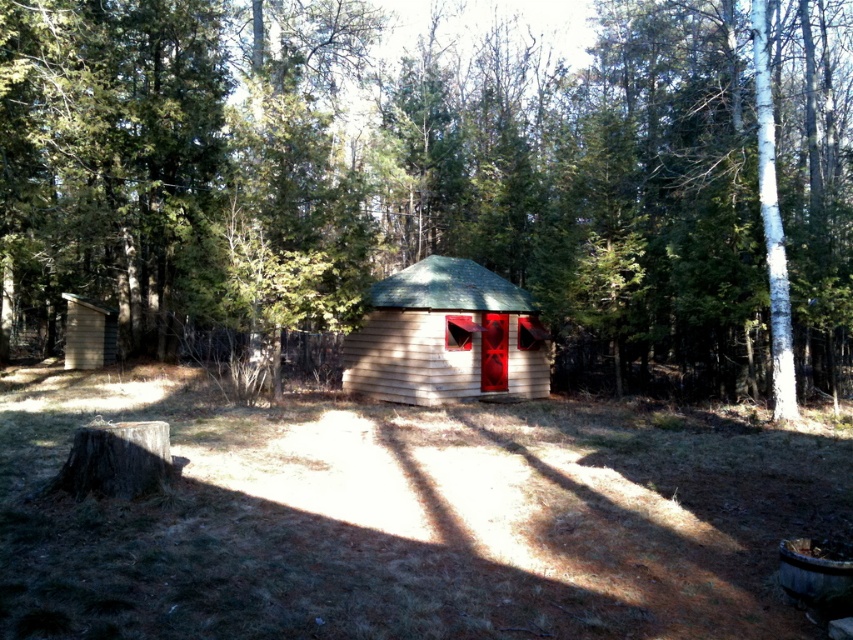
You are planning to build a small garden between the brown wood tree at center and the light brown wooden log cabin at center. Which object should you place the garden closer to if you want it to be near the larger structure?

The brown wood tree at center is bigger than the light brown wooden log cabin at center, so you should place the garden closer to the brown wood tree at center to be near the larger structure.

You are standing at the entrance of the rustic wooden cabin and notice two points marked on the ground. The first point is at coordinate point [756,227] and the second point is at coordinate point [428,378]. Which point is closer to you when facing the cabin?

Point [756,227] is in front of point [428,378], so it is closer to you when facing the cabin.

You are standing in the forest and want to walk from the brown wood tree at center to the light brown wooden log cabin at center. Which direction should you move relative to the tree?

You should move to the right relative to the brown wood tree at center because the light brown wooden log cabin at center is to the right of the tree.